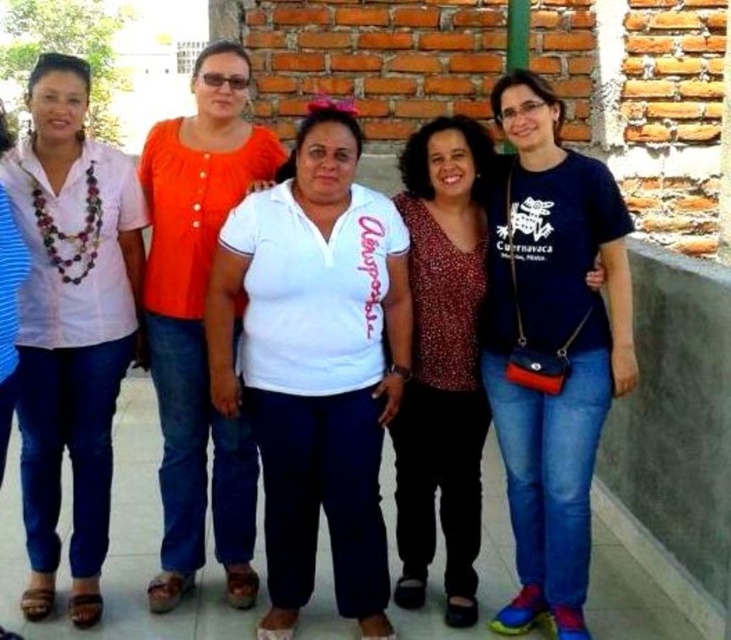
Based on the photo, is blue cotton t-shirt at center bigger than matte white blouse at left?

Yes.

Does blue cotton t-shirt at center lie in front of matte white blouse at left?

Yes, blue cotton t-shirt at center is closer to the viewer.

Is point (485, 355) farther from viewer compared to point (75, 481)?

Yes, it is behind point (75, 481).

This screenshot has width=731, height=640. I want to click on blue cotton t-shirt at center, so click(x=550, y=346).

Can you confirm if blue cotton t-shirt at center is positioned to the right of orange matte blouse at center?

Correct, you'll find blue cotton t-shirt at center to the right of orange matte blouse at center.

Does blue cotton t-shirt at center appear on the left side of orange matte blouse at center?

No, blue cotton t-shirt at center is not to the left of orange matte blouse at center.

You are a GUI agent. You are given a task and a screenshot of the screen. Output one action in this format:
    pyautogui.click(x=<x>, y=<y>)
    Task: Click on the blue cotton t-shirt at center
    
    Given the screenshot: What is the action you would take?
    [x=550, y=346]

Does orange matte blouse at center come in front of dark red textured blouse at center?

No, orange matte blouse at center is further to the viewer.

This screenshot has height=640, width=731. I want to click on orange matte blouse at center, so click(x=200, y=323).